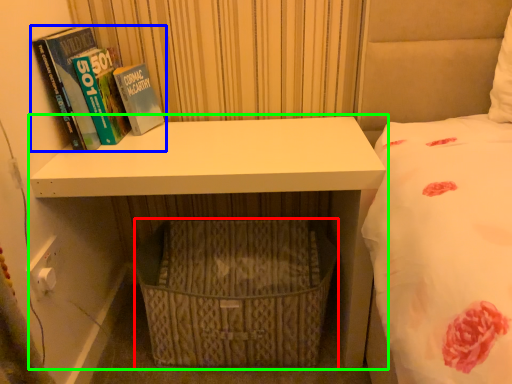
Question: Considering the real-world distances, which object is farthest from basket (highlighted by a red box)? book (highlighted by a blue box) or shelf (highlighted by a green box)?

Choices:
 (A) book
 (B) shelf

Answer: (A)